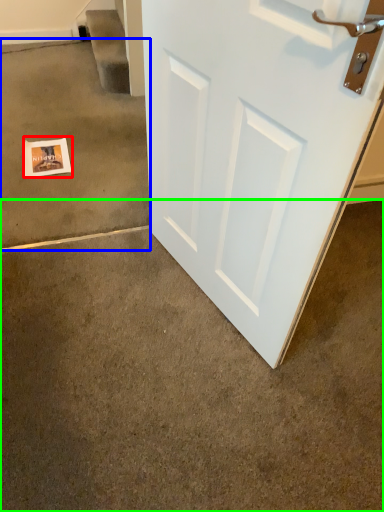
Question: Which object is the farthest from postcard (highlighted by a red box)? Choose among these: concrete (highlighted by a blue box) or concrete (highlighted by a green box).

Choices:
 (A) concrete
 (B) concrete

Answer: (B)